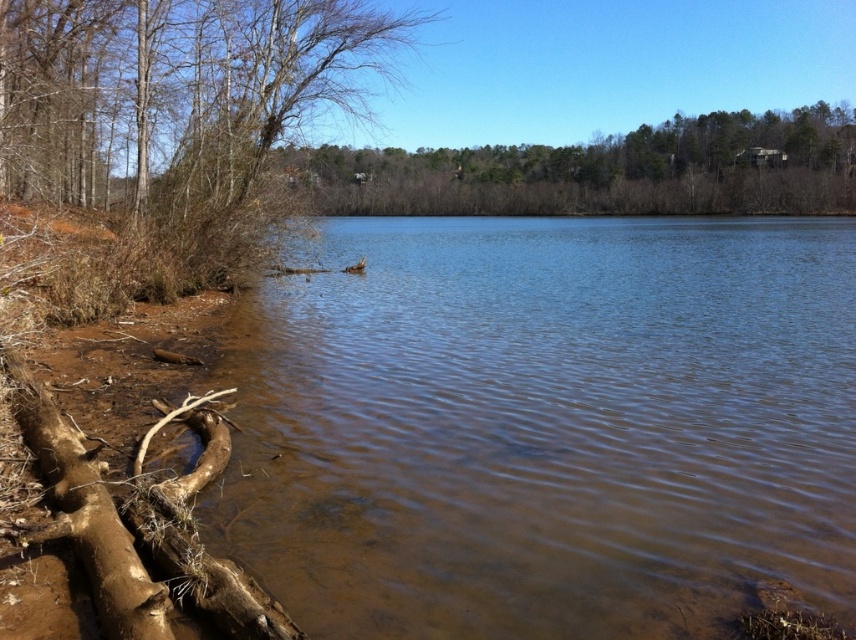
You are a kayaker planning to paddle from the brown bark tree at left to the brown sediment water at lower left. Based on the scene, which direction should you paddle to reach the sediment water?

The brown sediment water at lower left is larger in size than the brown bark tree at left, so you should paddle towards the lower left direction to reach the sediment water.